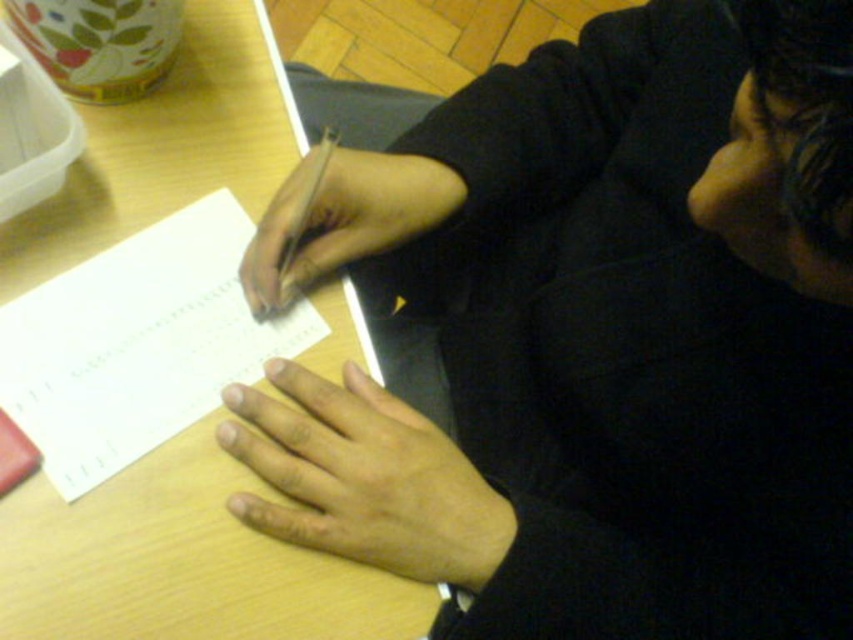
Question: Observing the image, what is the correct spatial positioning of dark matte hand at center in reference to white paper notebook at left?

Choices:
 (A) left
 (B) right

Answer: (B)

Question: Which point appears farthest from the camera in this image?

Choices:
 (A) (19, 483)
 (B) (202, 147)

Answer: (B)

Question: Which point is farther to the camera?

Choices:
 (A) (466, 396)
 (B) (67, 216)

Answer: (A)

Question: Which point is farther from the camera taking this photo?

Choices:
 (A) (32, 611)
 (B) (151, 394)
 (C) (688, 481)

Answer: (B)

Question: Is wooden table at center below smooth skin hand at center?

Choices:
 (A) yes
 (B) no

Answer: (A)

Question: Does wooden table at center have a larger size compared to white paper notepad at lower left?

Choices:
 (A) no
 (B) yes

Answer: (B)